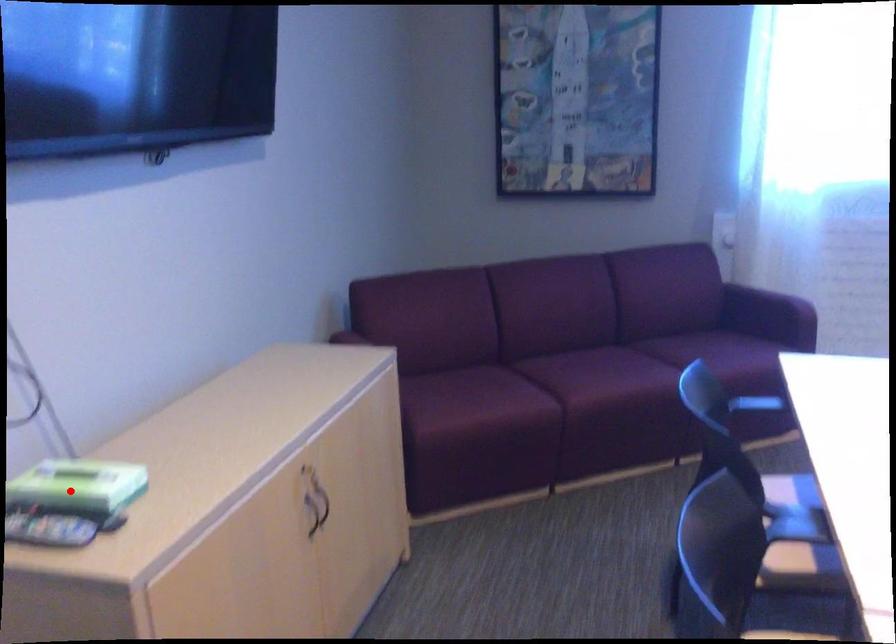
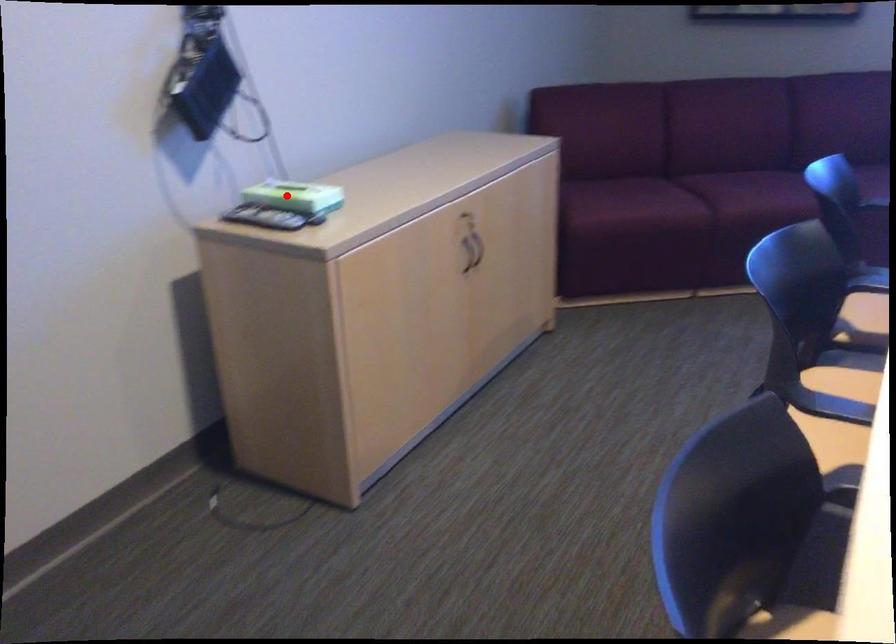
I am providing you with two images of the same scene from different viewpoints. A red point is marked on the first image and another point is marked on the second image. Is the red point in image1 aligned with the point shown in image2?

Yes